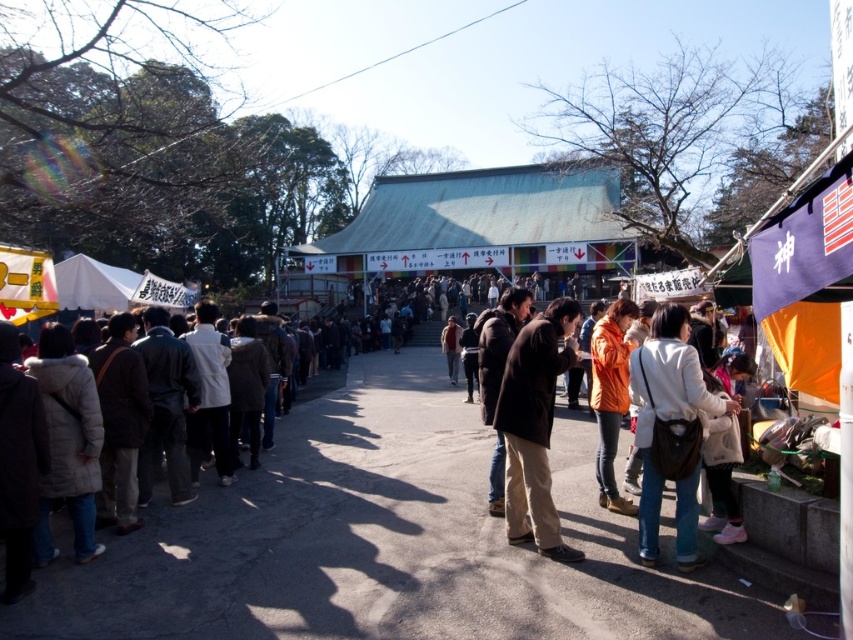
Question: Is light beige leather jacket at lower right further to camera compared to orange matte jacket at center?

Choices:
 (A) yes
 (B) no

Answer: (B)

Question: Which point appears farthest from the camera in this image?

Choices:
 (A) (515, 365)
 (B) (614, 388)

Answer: (B)

Question: Does light beige leather jacket at lower right appear on the right side of orange matte jacket at center?

Choices:
 (A) no
 (B) yes

Answer: (B)

Question: Considering the real-world distances, which object is closest to the dark brown leather jacket at center?

Choices:
 (A) light beige leather jacket at lower right
 (B) orange matte jacket at center

Answer: (A)

Question: Among these objects, which one is nearest to the camera?

Choices:
 (A) orange matte jacket at center
 (B) dark brown leather jacket at center

Answer: (B)

Question: Is dark brown leather jacket at center closer to the viewer compared to orange matte jacket at center?

Choices:
 (A) yes
 (B) no

Answer: (A)